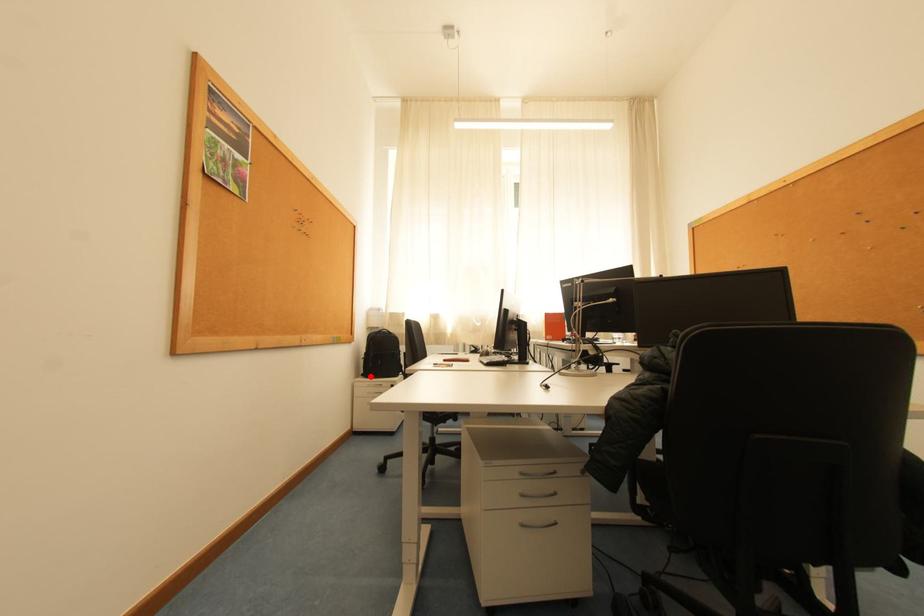
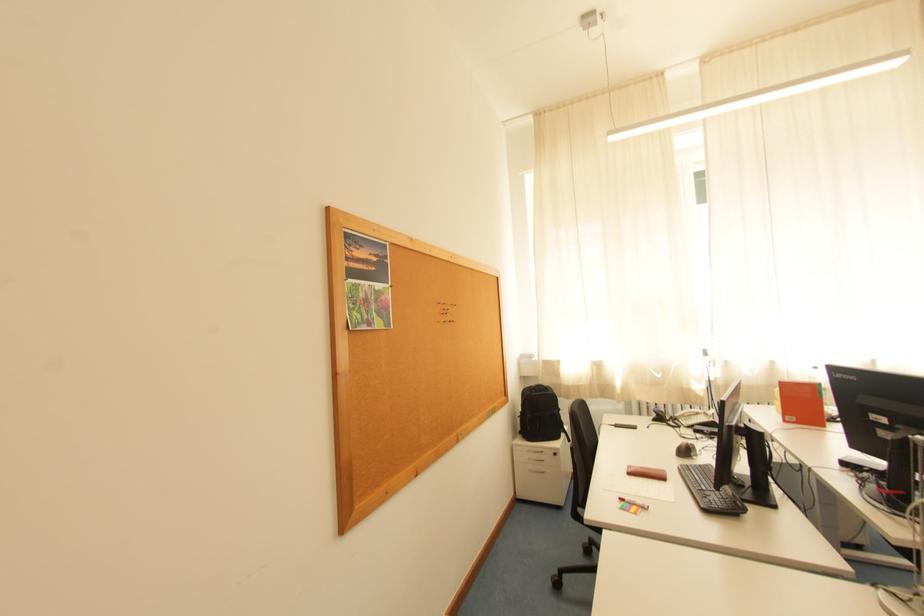
The point at the highlighted location is marked in the first image. Where is the corresponding point in the second image?

(528, 434)